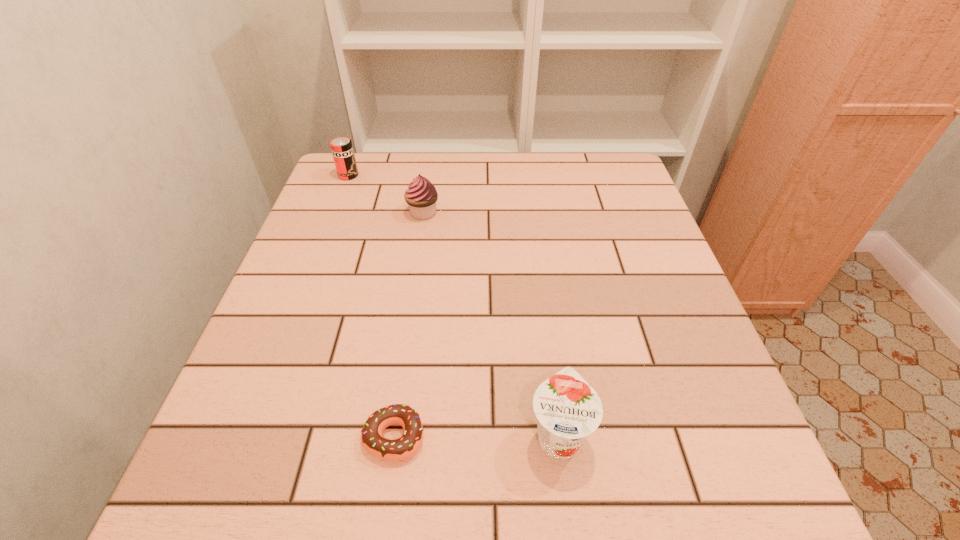
Find the location of a particular element. This screenshot has height=540, width=960. vacant area between the rightmost object and the doughnut is located at coordinates (476, 436).

You are a GUI agent. You are given a task and a screenshot of the screen. Output one action in this format:
    pyautogui.click(x=<x>, y=<y>)
    Task: Click on the vacant space that is in between the third nearest object and the leftmost object
    This screenshot has height=540, width=960.
    Given the screenshot: What is the action you would take?
    pyautogui.click(x=386, y=194)

Image resolution: width=960 pixels, height=540 pixels. I want to click on vacant area between the doughnut and the yogurt, so click(476, 436).

You are a GUI agent. You are given a task and a screenshot of the screen. Output one action in this format:
    pyautogui.click(x=<x>, y=<y>)
    Task: Click on the free space between the shortest object and the yogurt
    Image resolution: width=960 pixels, height=540 pixels.
    Given the screenshot: What is the action you would take?
    pyautogui.click(x=476, y=436)

Locate an element on the screen. The width and height of the screenshot is (960, 540). free space between the rightmost object and the cupcake is located at coordinates (491, 323).

At what (x,y) coordinates should I click in order to perform the action: click on free point between the third nearest object and the shortest object. Please return your answer as a coordinate pair (x, y). This screenshot has width=960, height=540. Looking at the image, I should click on (409, 325).

Locate an element on the screen. This screenshot has width=960, height=540. free space that is in between the shortest object and the yogurt is located at coordinates [476, 436].

The height and width of the screenshot is (540, 960). In order to click on empty space between the third nearest object and the can in this screenshot , I will do `click(386, 194)`.

Locate which object is the third closest to the farthest object. Please provide its 2D coordinates. Your answer should be formatted as a tuple, i.e. [(x, y)], where the tuple contains the x and y coordinates of a point satisfying the conditions above.

[(568, 409)]

Locate an element on the screen. object that is the closest one to the shortest object is located at coordinates (568, 409).